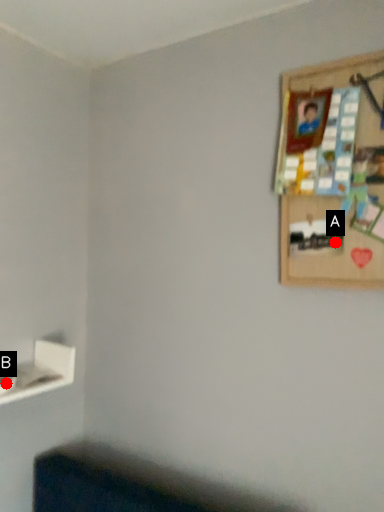
Question: Two points are circled on the image, labeled by A and B beside each circle. Which point is further to the camera?

Choices:
 (A) A is further
 (B) B is further

Answer: (B)